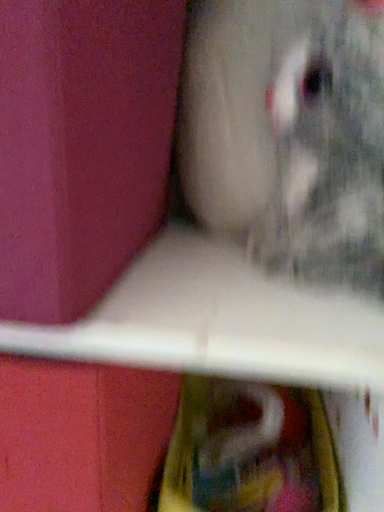
Question: Would you say matte pink box at left is inside or outside fuzzy gray cat at upper right?

Choices:
 (A) outside
 (B) inside

Answer: (A)

Question: Is matte pink box at left to the left or to the right of fuzzy gray cat at upper right in the image?

Choices:
 (A) left
 (B) right

Answer: (A)

Question: Considering the positions of point (87, 153) and point (374, 216), is point (87, 153) closer or farther from the camera than point (374, 216)?

Choices:
 (A) farther
 (B) closer

Answer: (B)

Question: Considering their positions, is fuzzy gray cat at upper right located in front of or behind matte pink box at left?

Choices:
 (A) behind
 (B) front

Answer: (A)

Question: In terms of width, does fuzzy gray cat at upper right look wider or thinner when compared to matte pink box at left?

Choices:
 (A) wide
 (B) thin

Answer: (B)

Question: Does point (307, 217) appear closer or farther from the camera than point (147, 201)?

Choices:
 (A) farther
 (B) closer

Answer: (A)

Question: Considering the positions of fuzzy gray cat at upper right and matte pink box at left in the image, is fuzzy gray cat at upper right taller or shorter than matte pink box at left?

Choices:
 (A) tall
 (B) short

Answer: (A)